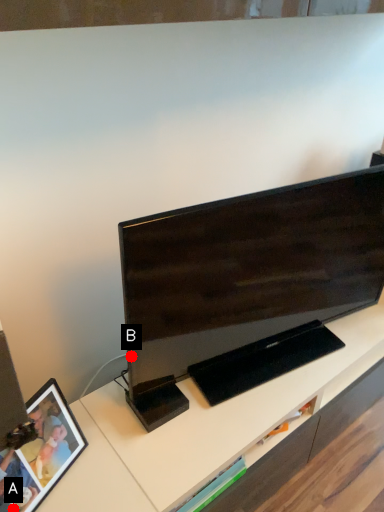
Question: Two points are circled on the image, labeled by A and B beside each circle. Which of the following is the closest to the observer?

Choices:
 (A) A is closer
 (B) B is closer

Answer: (A)